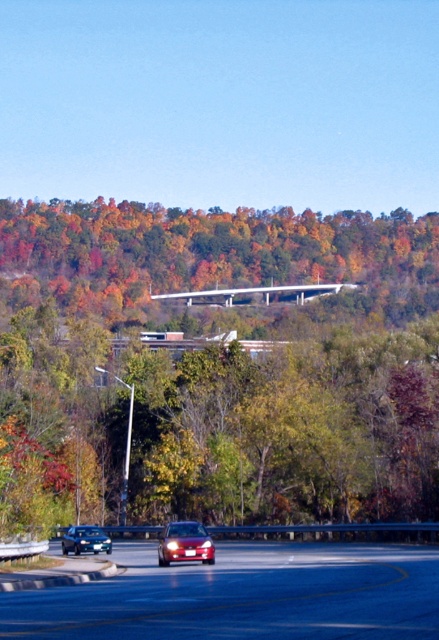
You are a pedestrian standing on the sidewalk next to the guardrail. You see the shiny red car at center and the shiny black sedan at lower left. Which vehicle is closer to you?

The shiny black sedan at lower left is closer to you because the shiny red car at center is located above it, meaning it is farther away in the scene.